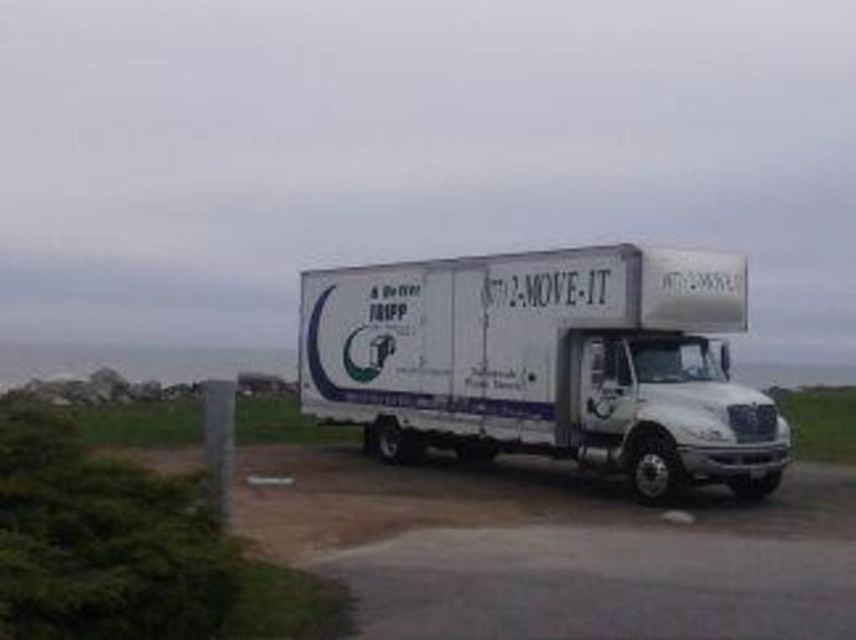
Can you confirm if white matte trailer truck at center is positioned to the left of green grass at lower left?

Incorrect, white matte trailer truck at center is not on the left side of green grass at lower left.

In the scene shown: Between white matte trailer truck at center and green grass at lower left, which one has less height?

Standing shorter between the two is green grass at lower left.

Where is `white matte trailer truck at center`? white matte trailer truck at center is located at coordinates (545, 362).

You are a GUI agent. You are given a task and a screenshot of the screen. Output one action in this format:
    pyautogui.click(x=<x>, y=<y>)
    Task: Click on the white matte trailer truck at center
    Image resolution: width=856 pixels, height=640 pixels.
    Given the screenshot: What is the action you would take?
    pyautogui.click(x=545, y=362)